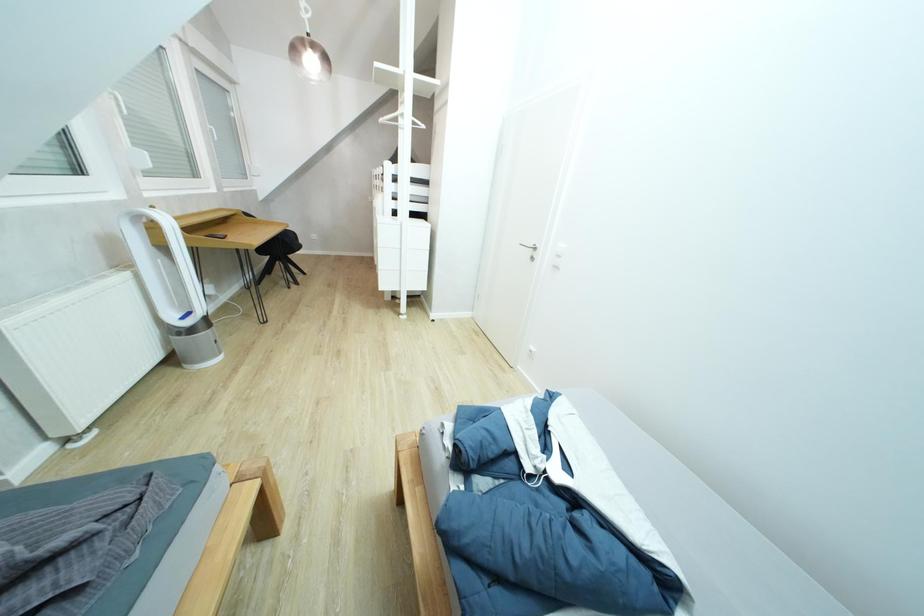
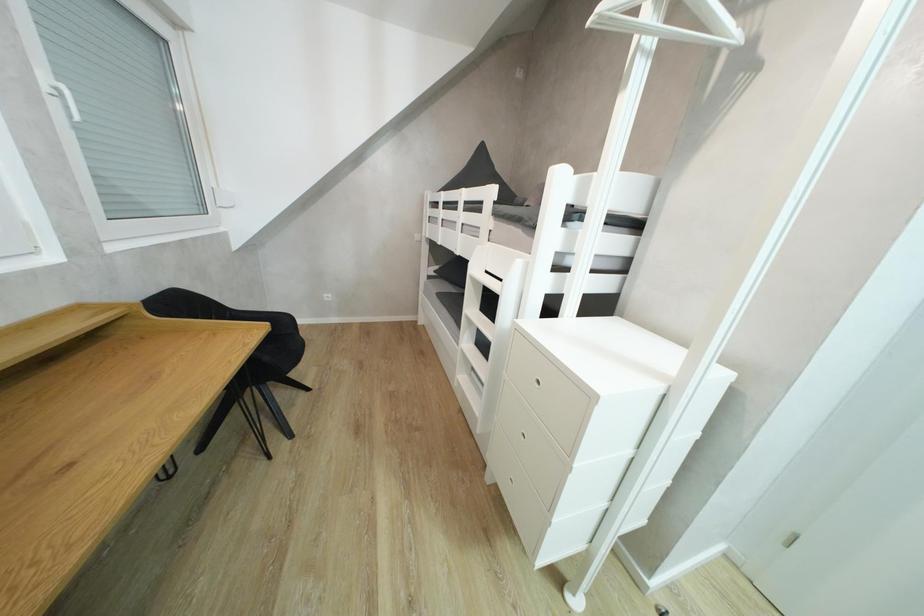
The images are taken continuously from a first-person perspective. In which direction are you moving?

The movement direction of the cameraman is left, forward.